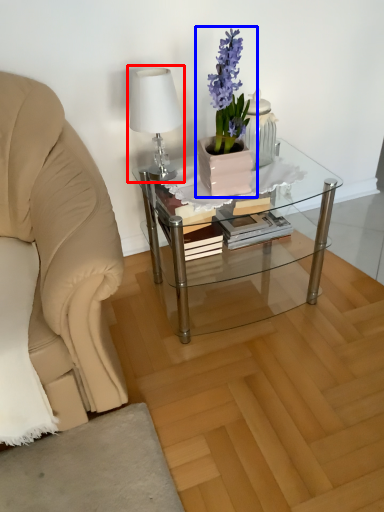
Question: Among these objects, which one is nearest to the camera, table lamp (highlighted by a red box) or houseplant (highlighted by a blue box)?

Choices:
 (A) table lamp
 (B) houseplant

Answer: (B)